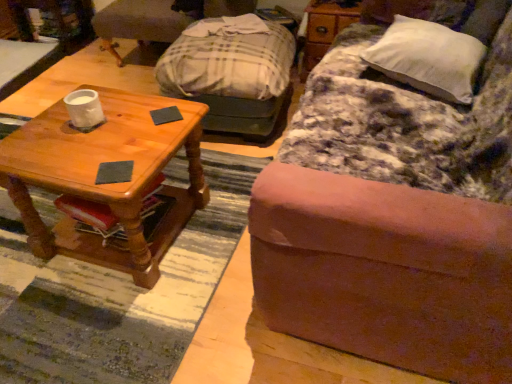
Locate an element on the screen. Image resolution: width=512 pixels, height=384 pixels. free space behind gray felt coaster at center, marked as the first pad in a front-to-back arrangement is located at coordinates (128, 142).